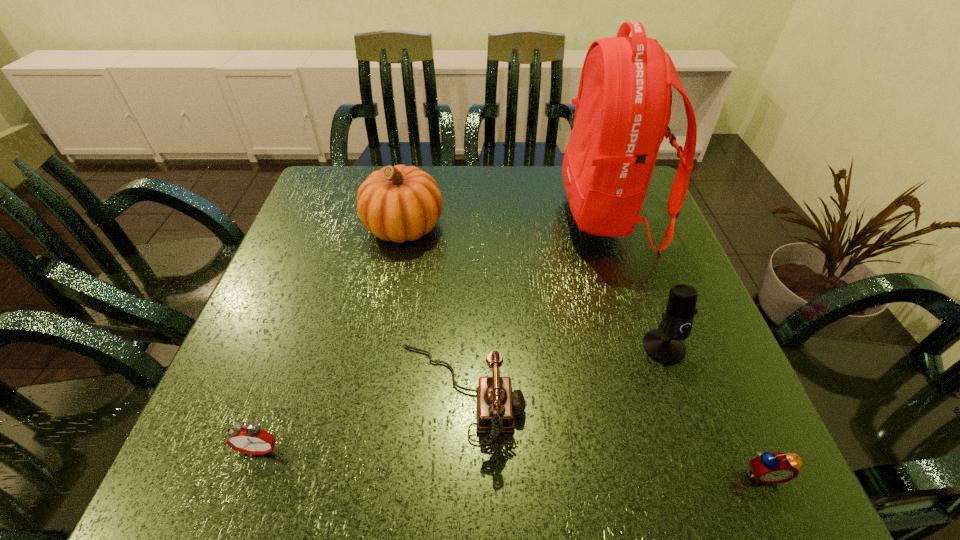
You are a GUI agent. You are given a task and a screenshot of the screen. Output one action in this format:
    pyautogui.click(x=<x>, y=<y>)
    Task: Click on the vacant region located on the left of the pumpkin
    
    Given the screenshot: What is the action you would take?
    pyautogui.click(x=326, y=227)

You are a GUI agent. You are given a task and a screenshot of the screen. Output one action in this format:
    pyautogui.click(x=<x>, y=<y>)
    Task: Click on the free space located on the stand of the microphone
    This screenshot has height=540, width=960.
    Given the screenshot: What is the action you would take?
    pyautogui.click(x=688, y=415)

Find the location of `vacant position located on the dial of the third shortest object`. vacant position located on the dial of the third shortest object is located at coordinates (640, 397).

Where is `backpack that is at the far edge`? This screenshot has height=540, width=960. backpack that is at the far edge is located at coordinates (623, 108).

The height and width of the screenshot is (540, 960). Identify the location of pumpkin present at the far edge. [x=397, y=203].

The width and height of the screenshot is (960, 540). I want to click on telephone present at the near edge, so click(496, 403).

This screenshot has height=540, width=960. Find the location of `object that is at the left edge`. object that is at the left edge is located at coordinates (252, 440).

Identify the location of backpack situated at the right edge. (623, 108).

Find the location of a particular element. The image size is (960, 540). microphone located at the right edge is located at coordinates (665, 345).

Image resolution: width=960 pixels, height=540 pixels. I want to click on alarm clock at the right edge, so click(x=769, y=468).